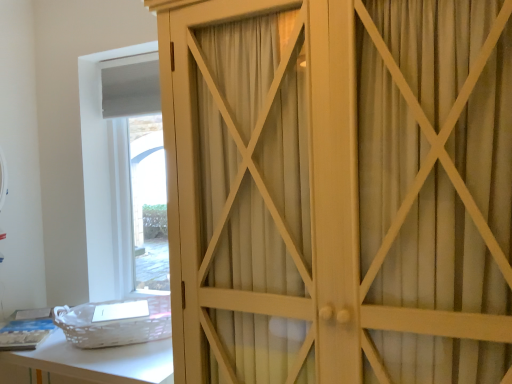
Question: Is white wicker basket at lower left wider or thinner than white wood cupboard at center?

Choices:
 (A) thin
 (B) wide

Answer: (A)

Question: Considering the positions of white wicker basket at lower left and white wood cupboard at center in the image, is white wicker basket at lower left taller or shorter than white wood cupboard at center?

Choices:
 (A) short
 (B) tall

Answer: (A)

Question: From a real-world perspective, is white wicker basket at lower left positioned above or below white wood cupboard at center?

Choices:
 (A) above
 (B) below

Answer: (B)

Question: Is point (442, 359) positioned closer to the camera than point (10, 360)?

Choices:
 (A) closer
 (B) farther

Answer: (A)

Question: Is white wood cupboard at center bigger or smaller than white wicker basket at lower left?

Choices:
 (A) big
 (B) small

Answer: (A)

Question: Considering their positions, is white wood cupboard at center located in front of or behind white wicker basket at lower left?

Choices:
 (A) behind
 (B) front

Answer: (B)

Question: Is white wood cupboard at center spatially inside white wicker basket at lower left, or outside of it?

Choices:
 (A) outside
 (B) inside

Answer: (A)